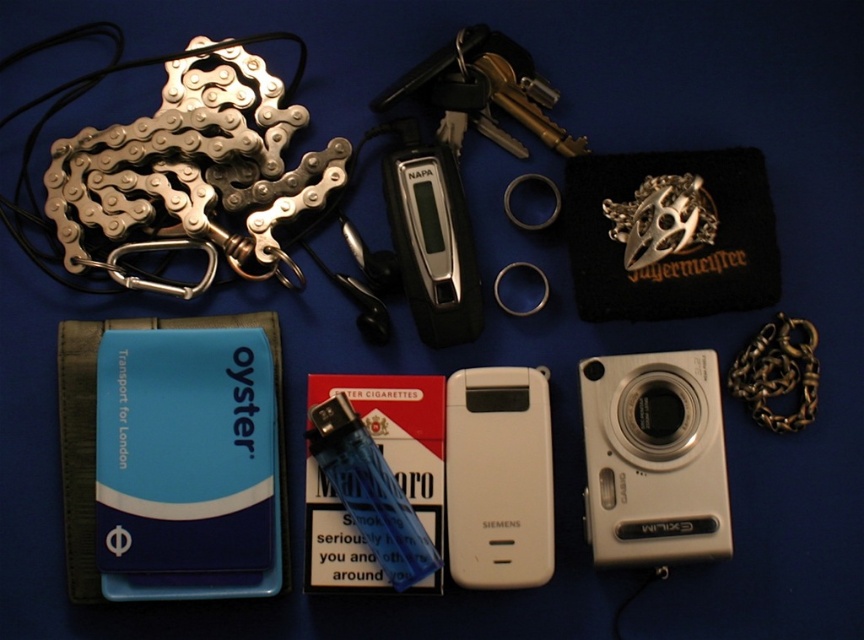
Consider the image. You are organizing a drawer and have both the white plastic camera at lower right and the white plastic phone at center. Which item requires a larger space to store?

The white plastic camera at lower right requires a larger space to store because it is larger in size than the white plastic phone at center.

You are organizing items on a shelf and need to place the white plastic camera at lower right and the gold metallic chain at right. Based on their positions in the image, which item should you place higher on the shelf to maintain the same arrangement?

To maintain the same arrangement, the gold metallic chain at right should be placed higher than the white plastic camera at lower right since the camera is positioned below the chain in the image.

You are a delivery person who needs to place a small package between the white plastic phone at center and the gold metallic chain at right. The package is 10 inches long. Will it fit between them?

The white plastic phone at center and gold metallic chain at right are 12.84 inches apart from each other. Since the package is 10 inches long, it will fit between them with some space to spare.